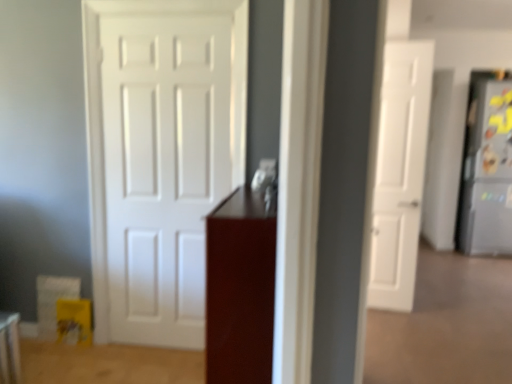
What do you see at coordinates (166, 165) in the screenshot? The width and height of the screenshot is (512, 384). I see `white matte door at center, the second door when ordered from back to front` at bounding box center [166, 165].

The image size is (512, 384). I want to click on white matte door at center, positioned as the 1th door in front-to-back order, so click(x=166, y=165).

What do you see at coordinates (400, 172) in the screenshot?
I see `white matte door at right, acting as the first door starting from the back` at bounding box center [400, 172].

This screenshot has width=512, height=384. In order to click on glossy wood cabinet at center in this screenshot , I will do `click(240, 288)`.

You are a GUI agent. You are given a task and a screenshot of the screen. Output one action in this format:
    pyautogui.click(x=<x>, y=<y>)
    Task: Click on the white matte door at center, placed as the 2th door when sorted from right to left
    
    Given the screenshot: What is the action you would take?
    pyautogui.click(x=166, y=165)

Is satin silver refrigerator at right far away from white matte door at right, the second door when ordered from left to right?

Yes, satin silver refrigerator at right and white matte door at right, the second door when ordered from left to right, are located far from each other.

From a real-world perspective, is satin silver refrigerator at right physically located above or below white matte door at right, the second door in the front-to-back sequence?

In terms of real-world spatial position, satin silver refrigerator at right is below white matte door at right, the second door in the front-to-back sequence.

What's the angular difference between satin silver refrigerator at right and white matte door at right, the second door when ordered from left to right,'s facing directions?

They differ by 7.08 degrees in their facing directions.

In the scene shown: Would you say satin silver refrigerator at right is outside white matte door at right, acting as the first door starting from the back?

Yes, satin silver refrigerator at right is not within white matte door at right, acting as the first door starting from the back.

Is white matte door at right, positioned as the first door in right-to-left order, surrounding white matte door at center, placed as the 2th door when sorted from right to left?

No, white matte door at center, placed as the 2th door when sorted from right to left, is located outside of white matte door at right, positioned as the first door in right-to-left order.

Is white matte door at right, the second door when ordered from left to right, in front of or behind white matte door at center, placed as the 2th door when sorted from right to left, in the image?

In the image, white matte door at right, the second door when ordered from left to right, appears behind white matte door at center, placed as the 2th door when sorted from right to left.

How many degrees apart are the facing directions of white matte door at right, the second door when ordered from left to right, and white matte door at center, positioned as the 1th door in front-to-back order?

white matte door at right, the second door when ordered from left to right, and white matte door at center, positioned as the 1th door in front-to-back order, are facing 6.74 degrees away from each other.

From a real-world perspective, is white matte door at right, the second door when ordered from left to right, positioned under white matte door at center, positioned as the 1th door in left-to-right order, based on gravity?

Yes, from a real-world perspective, white matte door at right, the second door when ordered from left to right, is under white matte door at center, positioned as the 1th door in left-to-right order.

Does white matte door at right, acting as the first door starting from the back, contain satin silver refrigerator at right?

No, white matte door at right, acting as the first door starting from the back, does not contain satin silver refrigerator at right.

From a real-world perspective, is white matte door at right, the second door when ordered from left to right, above or below satin silver refrigerator at right?

From a real-world perspective, white matte door at right, the second door when ordered from left to right, is physically above satin silver refrigerator at right.

From the picture: Is white matte door at right, the second door in the front-to-back sequence, looking in the opposite direction of satin silver refrigerator at right?

No.

Is point (394, 183) farther from camera compared to point (476, 226)?

No, it is not.

Considering the points (270, 276) and (379, 261), which point is behind, point (270, 276) or point (379, 261)?

The point (379, 261) is farther.

From a real-world perspective, which object rests below the other?

glossy wood cabinet at center.

Is glossy wood cabinet at center wider than white matte door at right, positioned as the first door in right-to-left order?

Correct, the width of glossy wood cabinet at center exceeds that of white matte door at right, positioned as the first door in right-to-left order.

Does glossy wood cabinet at center have a greater height compared to white matte door at right, acting as the first door starting from the back?

No.

Is glossy wood cabinet at center a part of white matte door at right, the second door in the front-to-back sequence?

Actually, glossy wood cabinet at center is outside white matte door at right, the second door in the front-to-back sequence.

In terms of size, does white matte door at right, the second door in the front-to-back sequence, appear bigger or smaller than glossy wood cabinet at center?

Clearly, white matte door at right, the second door in the front-to-back sequence, is smaller in size than glossy wood cabinet at center.

How different are the orientations of white matte door at right, the second door in the front-to-back sequence, and glossy wood cabinet at center in degrees?

82.8 degrees separate the facing orientations of white matte door at right, the second door in the front-to-back sequence, and glossy wood cabinet at center.

Would you say white matte door at right, positioned as the first door in right-to-left order, is to the left or to the right of glossy wood cabinet at center in the picture?

From the image, it's evident that white matte door at right, positioned as the first door in right-to-left order, is to the right of glossy wood cabinet at center.

Does white matte door at center, the second door when ordered from back to front, turn towards white matte door at right, acting as the first door starting from the back?

No, white matte door at center, the second door when ordered from back to front, is not turned towards white matte door at right, acting as the first door starting from the back.

Considering the relative sizes of white matte door at center, positioned as the 1th door in front-to-back order, and white matte door at right, the second door when ordered from left to right, in the image provided, is white matte door at center, positioned as the 1th door in front-to-back order, wider than white matte door at right, the second door when ordered from left to right,?

In fact, white matte door at center, positioned as the 1th door in front-to-back order, might be narrower than white matte door at right, the second door when ordered from left to right.

Identify the location of door below the white matte door at right, acting as the first door starting from the back (from the image's perspective). (166, 165).

Based on the photo, does glossy wood cabinet at center turn towards white matte door at center, placed as the 2th door when sorted from right to left?

Yes.

Which is closer, (272, 201) or (123, 205)?

Point (272, 201) is positioned closer to the camera compared to point (123, 205).

Can white matte door at center, the second door when ordered from back to front, be found inside glossy wood cabinet at center?

No, white matte door at center, the second door when ordered from back to front, is not inside glossy wood cabinet at center.

Based on the photo, can you confirm if glossy wood cabinet at center is taller than white matte door at center, positioned as the 1th door in left-to-right order?

No.

Identify the location of fridge directly beneath the white matte door at right, acting as the first door starting from the back (from a real-world perspective). The image size is (512, 384). pyautogui.click(x=487, y=170).

The width and height of the screenshot is (512, 384). Find the location of `door located above the white matte door at center, placed as the 2th door when sorted from right to left (from the image's perspective)`. door located above the white matte door at center, placed as the 2th door when sorted from right to left (from the image's perspective) is located at coordinates (400, 172).

Estimate the real-world distances between objects in this image. Which object is further from white matte door at center, positioned as the 1th door in front-to-back order, satin silver refrigerator at right or glossy wood cabinet at center?

The object further to white matte door at center, positioned as the 1th door in front-to-back order, is satin silver refrigerator at right.

Which object lies nearer to the anchor point white matte door at center, positioned as the 1th door in left-to-right order, satin silver refrigerator at right or white matte door at right, the second door when ordered from left to right?

white matte door at right, the second door when ordered from left to right.

Considering their positions, is white matte door at center, the second door when ordered from back to front, positioned further to glossy wood cabinet at center than white matte door at right, the second door when ordered from left to right?

white matte door at right, the second door when ordered from left to right, is positioned further to the anchor glossy wood cabinet at center.

Estimate the real-world distances between objects in this image. Which object is closer to satin silver refrigerator at right, white matte door at center, positioned as the 1th door in front-to-back order, or glossy wood cabinet at center?

Among the two, white matte door at center, positioned as the 1th door in front-to-back order, is located nearer to satin silver refrigerator at right.

Based on their spatial positions, is glossy wood cabinet at center or white matte door at center, the second door when ordered from back to front, closer to white matte door at right, acting as the first door starting from the back?

Based on the image, white matte door at center, the second door when ordered from back to front, appears to be nearer to white matte door at right, acting as the first door starting from the back.

When comparing their distances from glossy wood cabinet at center, does white matte door at center, positioned as the 1th door in front-to-back order, or satin silver refrigerator at right seem closer?

white matte door at center, positioned as the 1th door in front-to-back order, lies closer to glossy wood cabinet at center than the other object.

Which object lies further to the anchor point white matte door at right, the second door when ordered from left to right, satin silver refrigerator at right or glossy wood cabinet at center?

satin silver refrigerator at right lies further to white matte door at right, the second door when ordered from left to right, than the other object.

Based on the photo, when comparing their distances from white matte door at center, positioned as the 1th door in front-to-back order, does white matte door at right, the second door in the front-to-back sequence, or glossy wood cabinet at center seem further?

The object further to white matte door at center, positioned as the 1th door in front-to-back order, is white matte door at right, the second door in the front-to-back sequence.

The height and width of the screenshot is (384, 512). In order to click on furniture between white matte door at center, the second door when ordered from back to front, and satin silver refrigerator at right from left to right in this screenshot , I will do `click(240, 288)`.

Find the location of a particular element. The width and height of the screenshot is (512, 384). furniture located between white matte door at center, positioned as the 1th door in front-to-back order, and white matte door at right, acting as the first door starting from the back, in the left-right direction is located at coordinates (240, 288).

Where is `door situated between white matte door at center, positioned as the 1th door in front-to-back order, and satin silver refrigerator at right from left to right`? This screenshot has width=512, height=384. door situated between white matte door at center, positioned as the 1th door in front-to-back order, and satin silver refrigerator at right from left to right is located at coordinates (400, 172).